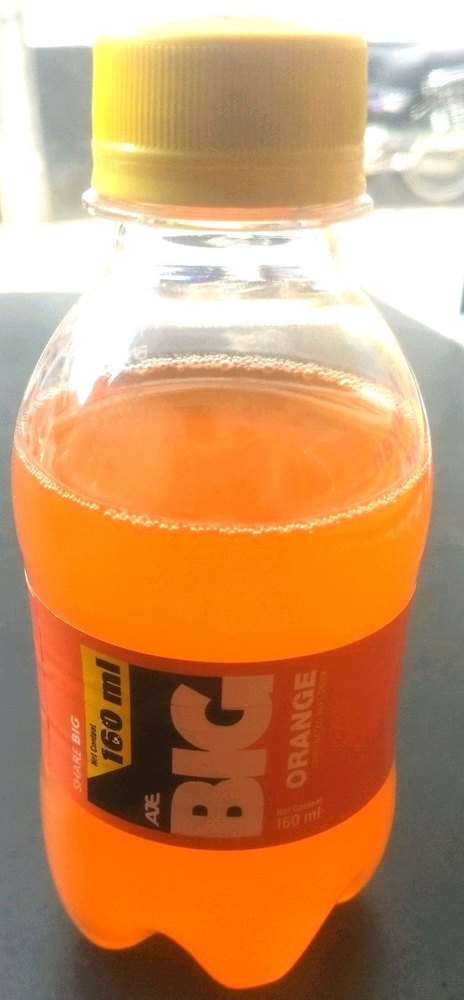
The width and height of the screenshot is (464, 1000). In order to click on bottle in this screenshot , I will do `click(283, 558)`.